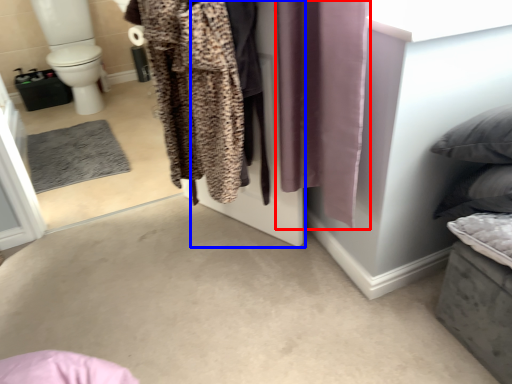
Question: Which of the following is the farthest to the observer, curtain (highlighted by a red box) or screen door (highlighted by a blue box)?

Choices:
 (A) curtain
 (B) screen door

Answer: (B)